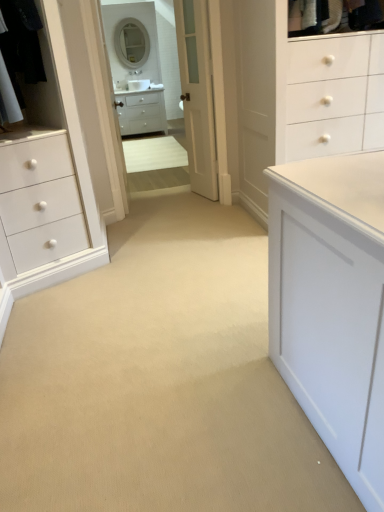
Question: Considering the positions of white glossy medicine cabinet at upper center and black fabric laundry at upper left in the image, is white glossy medicine cabinet at upper center bigger or smaller than black fabric laundry at upper left?

Choices:
 (A) small
 (B) big

Answer: (A)

Question: Based on their positions, is white glossy medicine cabinet at upper center located to the left or right of black fabric laundry at upper left?

Choices:
 (A) left
 (B) right

Answer: (B)

Question: Based on their relative distances, which object is nearer to the black fabric laundry at upper left?

Choices:
 (A) white glossy mirror at upper center, which is the second mirror in bottom-to-top order
 (B) white wood door at center
 (C) white glossy mirror at upper center, the second mirror in the top-to-bottom sequence
 (D) white glossy cabinet at center
 (E) white glossy medicine cabinet at upper center

Answer: (E)

Question: Estimate the real-world distances between objects in this image. Which object is closer to the white glossy cabinet at center?

Choices:
 (A) black fabric laundry at upper left
 (B) white glossy mirror at upper center, which is the 1th mirror from bottom to top
 (C) white glossy medicine cabinet at upper center
 (D) white wood door at center
 (E) white glossy mirror at upper center, which is the second mirror in bottom-to-top order

Answer: (B)